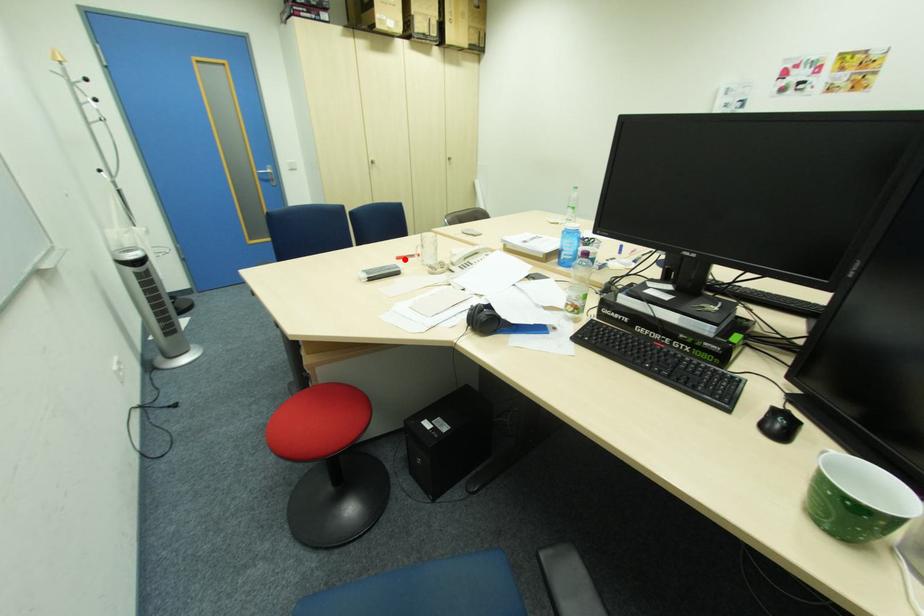
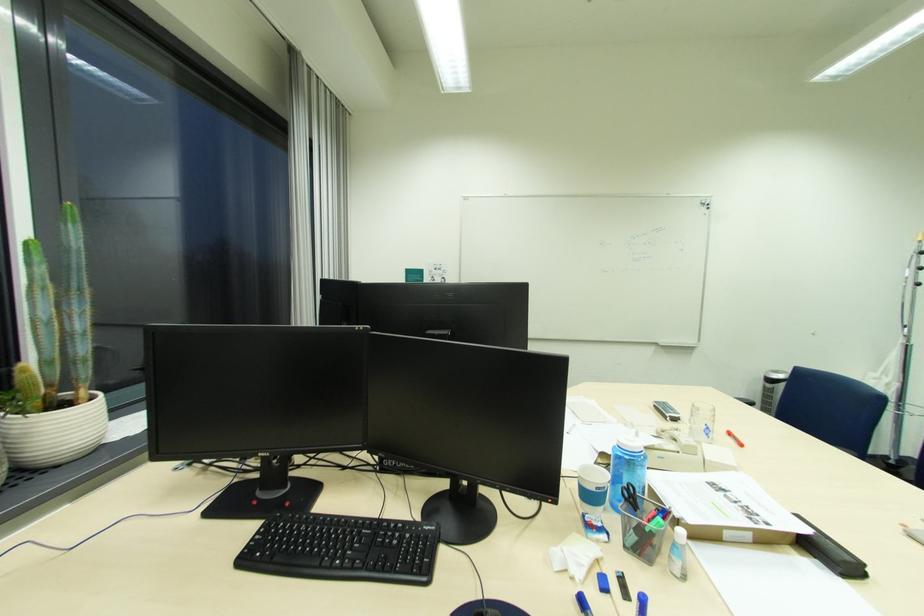
Find the pixel in the second image that matches the highlighted location in the first image.

(736, 435)